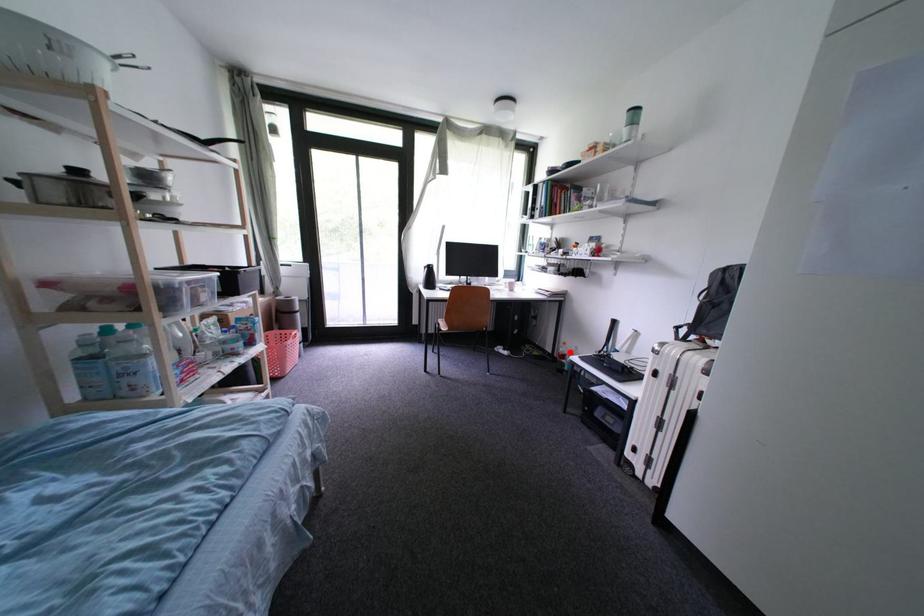
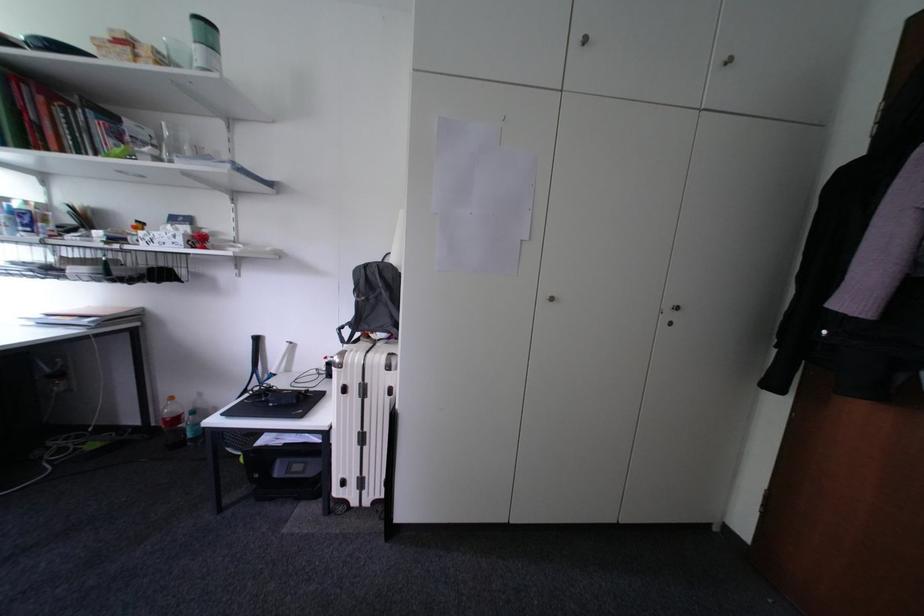
The point at the highlighted location is marked in the first image. Where is the corresponding point in the second image?

(176, 413)